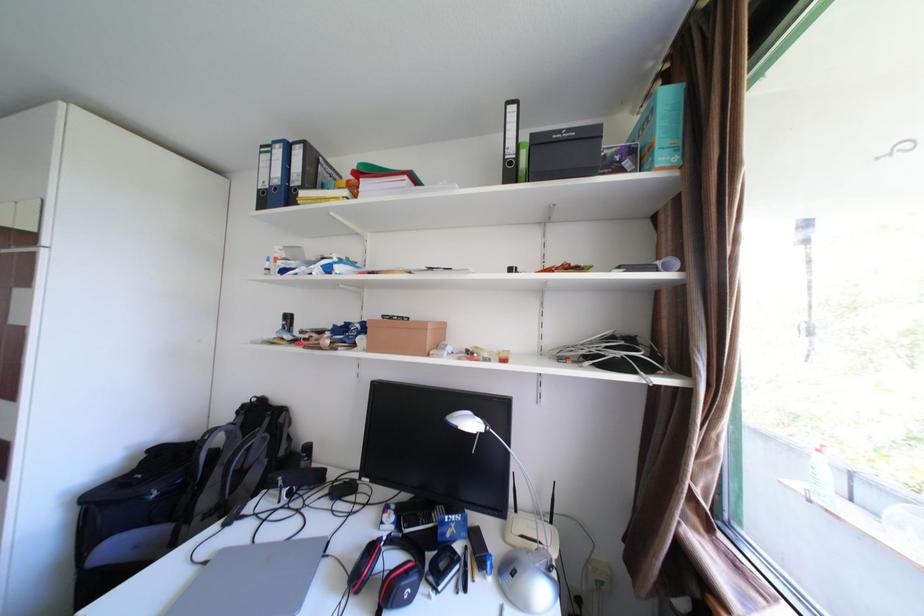
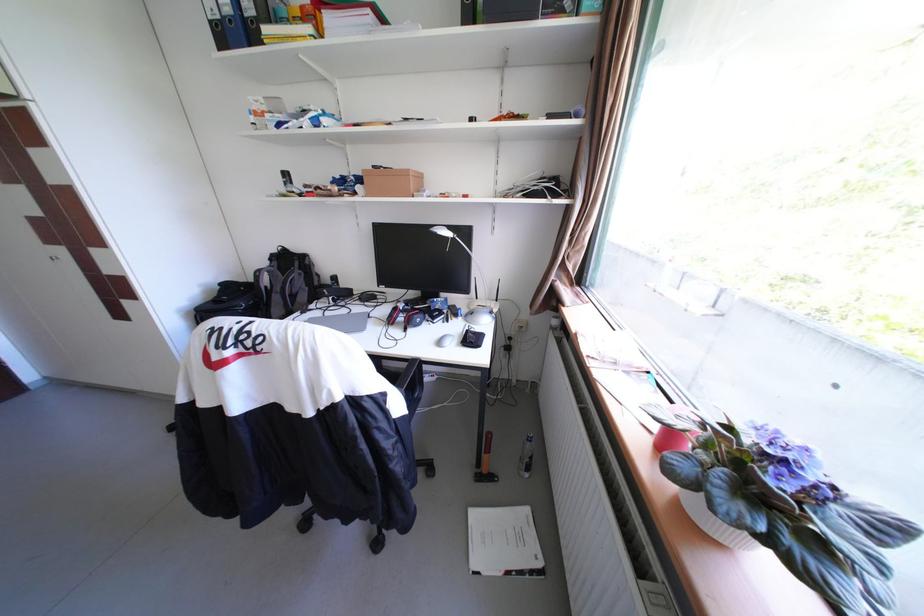
Question: How did the camera likely rotate?

Choices:
 (A) Left
 (B) Right
 (C) Up
 (D) Down

Answer: (D)